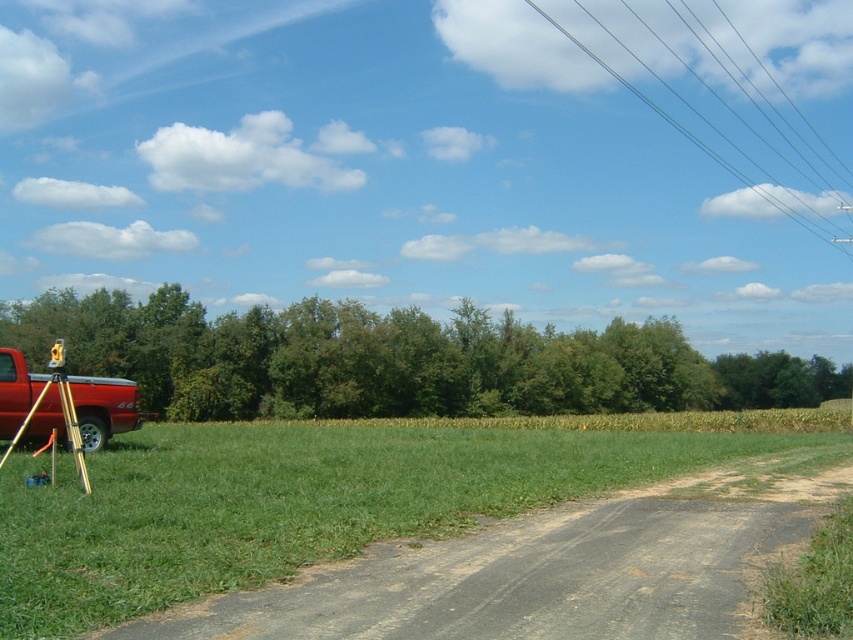
You are a farmer checking the boundaries of your property. You see the metallic red pickup truck at left and the black wire at upper right. Which object is wider?

The metallic red pickup truck at left is narrower than the black wire at upper right, so the black wire at upper right is wider.

You are a delivery driver who needs to cross the gray asphalt road at lower center. Your truck has a height of 4.5 meters. Can you safely pass under the camera mounted above the road?

The distance between the gray asphalt road at lower center and the camera is 5.24 meters. Since your truck is 4.5 meters tall, there is enough clearance. You can safely pass under the camera mounted above the gray asphalt road at lower center.

From the picture: You are a surveyor standing at the gold metallic tripod at lower left, looking towards the metallic red pickup truck at left. Which direction should you walk to reach the truck?

The metallic red pickup truck at left is below the gold metallic tripod at lower left, so you should walk downward to reach the truck.